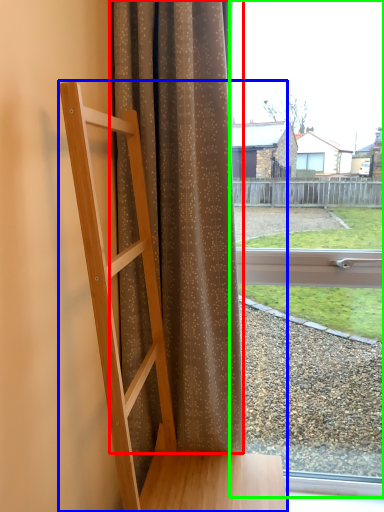
Question: Considering the real-world distances, which object is closest to curtain (highlighted by a red box)? furniture (highlighted by a blue box) or window (highlighted by a green box).

Choices:
 (A) furniture
 (B) window

Answer: (A)